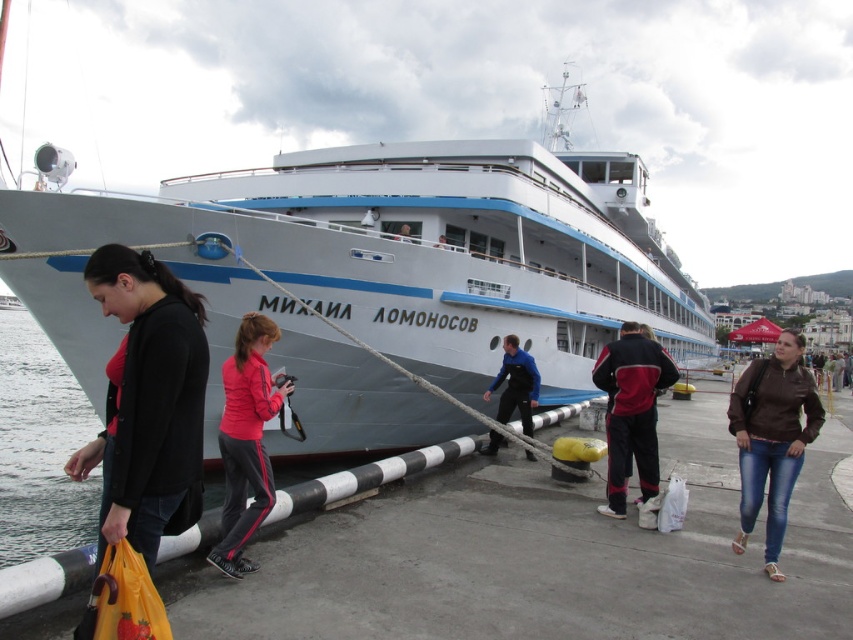
Question: Where is matte black jacket at lower left located in relation to red fabric jacket at center in the image?

Choices:
 (A) above
 (B) below

Answer: (A)

Question: Does red fabric jacket at center have a larger size compared to blue smooth jacket at center?

Choices:
 (A) no
 (B) yes

Answer: (B)

Question: Which of the following is the closest to the observer?

Choices:
 (A) (144, 435)
 (B) (653, 435)
 (C) (582, 349)

Answer: (A)

Question: Which point is closer to the camera?

Choices:
 (A) white glossy ship at center
 (B) brown leather jacket at lower right
 (C) red and black tracksuit at center
 (D) blue smooth jacket at center

Answer: (B)

Question: Which point appears farthest from the camera in this image?

Choices:
 (A) (163, 442)
 (B) (767, 529)
 (C) (225, 404)
 (D) (641, 358)

Answer: (D)

Question: Is matte black jacket at lower left below red fabric jacket at center?

Choices:
 (A) no
 (B) yes

Answer: (A)